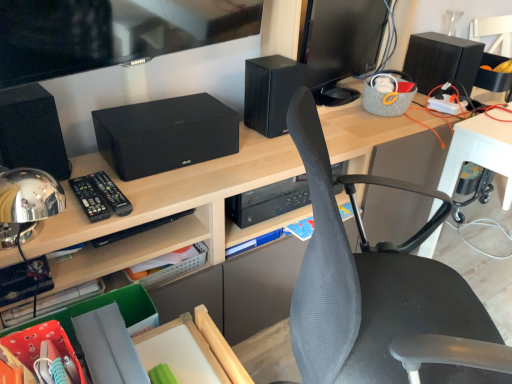
Describe the element at coordinates (32, 131) in the screenshot. I see `black matte speaker at upper left, the third speaker in the right-to-left sequence` at that location.

Image resolution: width=512 pixels, height=384 pixels. I want to click on black matte speaker at center, so click(165, 134).

What do you see at coordinates (111, 193) in the screenshot? I see `black plastic remote at center, positioned as the first control in right-to-left order` at bounding box center [111, 193].

You are a GUI agent. You are given a task and a screenshot of the screen. Output one action in this format:
    pyautogui.click(x=<x>, y=<y>)
    Task: Click on the gray mesh chair at center
    This screenshot has height=384, width=512.
    Given the screenshot: What is the action you would take?
    pyautogui.click(x=381, y=293)

Locate an element on the screen. black plastic remote at left, which appears as the 1th control when viewed from the left is located at coordinates (90, 199).

What is the approximate width of black glossy monitor at upper right?

It is 7.28 inches.

The width and height of the screenshot is (512, 384). What are the coordinates of `black matte speaker at upper left, which appears as the first speaker when viewed from the left` in the screenshot? It's located at (32, 131).

Between point (175, 121) and point (265, 122), which one is positioned in front?

The point (175, 121) is more forward.

How many degrees apart are the facing directions of black matte speaker at center and black matte speaker at center, the 2th speaker in the left-to-right sequence?

4.95 degrees.

Considering their positions, is black matte speaker at center located in front of or behind black matte speaker at center, which ranks as the 2th speaker in front-to-back order?

Visually, black matte speaker at center is located in front of black matte speaker at center, which ranks as the 2th speaker in front-to-back order.

Could you tell me if black matte speaker at center is facing black matte speaker at center, positioned as the 2th speaker in back-to-front order?

No, black matte speaker at center is not aimed at black matte speaker at center, positioned as the 2th speaker in back-to-front order.

Which of these two, black plastic remote at center, which appears as the second control when viewed from the left, or black matte speaker at center, positioned as the 2th speaker in back-to-front order, is bigger?

Bigger between the two is black matte speaker at center, positioned as the 2th speaker in back-to-front order.

Can black matte speaker at center, the 2th speaker in the left-to-right sequence, be found inside black plastic remote at center, which appears as the second control when viewed from the left?

That's incorrect, black matte speaker at center, the 2th speaker in the left-to-right sequence, is not inside black plastic remote at center, which appears as the second control when viewed from the left.

Does black plastic remote at center, positioned as the first control in right-to-left order, have a greater width compared to black matte speaker at center, the second speaker from the right?

Yes.

Considering their positions, is black plastic remote at center, positioned as the first control in right-to-left order, located in front of or behind black matte speaker at center, the 2th speaker in the left-to-right sequence?

black plastic remote at center, positioned as the first control in right-to-left order, is in front of black matte speaker at center, the 2th speaker in the left-to-right sequence.

Is black glossy monitor at upper right next to black plastic remote at left, the second control positioned from the right?

black glossy monitor at upper right and black plastic remote at left, the second control positioned from the right, are not in contact.

Can you confirm if black glossy monitor at upper right is wider than black plastic remote at left, which appears as the 1th control when viewed from the left?

Incorrect, the width of black glossy monitor at upper right does not surpass that of black plastic remote at left, which appears as the 1th control when viewed from the left.

Is black glossy monitor at upper right at the left side of black plastic remote at left, the second control positioned from the right?

In fact, black glossy monitor at upper right is to the right of black plastic remote at left, the second control positioned from the right.

Is black glossy monitor at upper right inside or outside of black plastic remote at left, which appears as the 1th control when viewed from the left?

The correct answer is: outside.

Considering the relative sizes of black plastic remote at left, which appears as the 1th control when viewed from the left, and black matte speaker at upper left, which appears as the first speaker when viewed from the left, in the image provided, is black plastic remote at left, which appears as the 1th control when viewed from the left, thinner than black matte speaker at upper left, which appears as the first speaker when viewed from the left,?

No.

Looking at this image, is black plastic remote at left, which appears as the 1th control when viewed from the left, placed right next to black matte speaker at upper left, positioned as the third speaker in back-to-front order?

No, black plastic remote at left, which appears as the 1th control when viewed from the left, is not beside black matte speaker at upper left, positioned as the third speaker in back-to-front order.

Which is more to the left, black plastic remote at left, which appears as the 1th control when viewed from the left, or black matte speaker at upper left, the third speaker in the right-to-left sequence?

black matte speaker at upper left, the third speaker in the right-to-left sequence.

From a real-world perspective, is gray mesh chair at center above or below black matte speaker at center?

In terms of real-world spatial position, gray mesh chair at center is below black matte speaker at center.

Looking at this image, looking at their sizes, would you say gray mesh chair at center is wider or thinner than black matte speaker at center?

In the image, gray mesh chair at center appears to be wider than black matte speaker at center.

Relative to black matte speaker at center, is gray mesh chair at center in front or behind?

Clearly, gray mesh chair at center is in front of black matte speaker at center.

Is gray mesh chair at center positioned beyond the bounds of black matte speaker at center?

Yes, gray mesh chair at center is outside of black matte speaker at center.

Considering the relative positions of black plastic remote at center, positioned as the first control in right-to-left order, and black matte speaker at upper left, the third speaker in the right-to-left sequence, in the image provided, is black plastic remote at center, positioned as the first control in right-to-left order, to the left or to the right of black matte speaker at upper left, the third speaker in the right-to-left sequence,?

In the image, black plastic remote at center, positioned as the first control in right-to-left order, appears on the right side of black matte speaker at upper left, the third speaker in the right-to-left sequence.

From the image's perspective, is black plastic remote at center, which appears as the second control when viewed from the left, located beneath black matte speaker at upper left, acting as the 1th speaker starting from the front?

Correct, black plastic remote at center, which appears as the second control when viewed from the left, appears lower than black matte speaker at upper left, acting as the 1th speaker starting from the front, in the image.

Does black plastic remote at center, positioned as the first control in right-to-left order, turn towards black matte speaker at upper left, positioned as the third speaker in back-to-front order?

No, black plastic remote at center, positioned as the first control in right-to-left order, is not turned towards black matte speaker at upper left, positioned as the third speaker in back-to-front order.

Considering the relative sizes of gray mesh chair at center and black matte speaker at center, the 2th speaker in the left-to-right sequence, in the image provided, is gray mesh chair at center thinner than black matte speaker at center, the 2th speaker in the left-to-right sequence,?

Incorrect, the width of gray mesh chair at center is not less than that of black matte speaker at center, the 2th speaker in the left-to-right sequence.

Between point (398, 286) and point (290, 82), which one is positioned in front?

The point (398, 286) is more forward.

Can you confirm if gray mesh chair at center is positioned to the left of black matte speaker at center, the 2th speaker in the left-to-right sequence?

In fact, gray mesh chair at center is to the right of black matte speaker at center, the 2th speaker in the left-to-right sequence.

Find the location of a particular element. The width and height of the screenshot is (512, 384). printer in front of the black matte speaker at center, positioned as the 2th speaker in back-to-front order is located at coordinates (165, 134).

From the black matte speaker at center, which ranks as the 2th speaker in front-to-back order, count the 1st control to the left and point to it. Please provide its 2D coordinates.

[(111, 193)]

Based on the photo, considering their positions, is black plastic remote at center, which appears as the second control when viewed from the left, positioned further to black plastic remote at left, the second control positioned from the right, than black matte speaker at center?

black matte speaker at center.

Estimate the real-world distances between objects in this image. Which object is further from black glossy monitor at upper right, gray mesh chair at center or black matte speaker at center, which ranks as the 2th speaker in front-to-back order?

gray mesh chair at center is positioned further to the anchor black glossy monitor at upper right.

From the image, which object appears to be nearer to gray mesh chair at center, black glossy monitor at upper right or black matte speaker at center?

The object closer to gray mesh chair at center is black matte speaker at center.

Looking at the image, which one is located further to black plastic remote at left, the second control positioned from the right, gray mesh chair at center or black glossy monitor at upper right?

black glossy monitor at upper right lies further to black plastic remote at left, the second control positioned from the right, than the other object.

Based on their spatial positions, is black matte speaker at center, positioned as the 2th speaker in back-to-front order, or black glossy monitor at upper right further from black plastic remote at center, which appears as the second control when viewed from the left?

black glossy monitor at upper right lies further to black plastic remote at center, which appears as the second control when viewed from the left, than the other object.

From the image, which object appears to be nearer to black plastic remote at center, which appears as the second control when viewed from the left, black plastic remote at left, the second control positioned from the right, or gray mesh chair at center?

Among the two, black plastic remote at left, the second control positioned from the right, is located nearer to black plastic remote at center, which appears as the second control when viewed from the left.

Estimate the real-world distances between objects in this image. Which object is further from black plastic remote at left, the second control positioned from the right, black matte speaker at upper left, positioned as the third speaker in back-to-front order, or gray mesh chair at center?

gray mesh chair at center lies further to black plastic remote at left, the second control positioned from the right, than the other object.

Looking at the image, which one is located closer to black plastic remote at left, which appears as the 1th control when viewed from the left, black matte speaker at center, the second speaker from the right, or black matte speaker at upper left, positioned as the third speaker in back-to-front order?

The object closer to black plastic remote at left, which appears as the 1th control when viewed from the left, is black matte speaker at upper left, positioned as the third speaker in back-to-front order.

Image resolution: width=512 pixels, height=384 pixels. I want to click on computer monitor located between black matte speaker at center and black matte speaker at upper right, placed as the third speaker when sorted from front to back, in the left-right direction, so click(x=341, y=45).

Locate an element on the screen. This screenshot has height=384, width=512. speaker situated between black plastic remote at left, the second control positioned from the right, and black matte speaker at upper right, which appears as the 1th speaker when viewed from the right, from left to right is located at coordinates (270, 92).

At what (x,y) coordinates should I click in order to perform the action: click on speaker located between black matte speaker at center and black matte speaker at upper right, which appears as the 1th speaker when viewed from the right, in the left-right direction. Please return your answer as a coordinate pair (x, y). The height and width of the screenshot is (384, 512). Looking at the image, I should click on (270, 92).

Find the location of a particular element. printer between black matte speaker at upper left, the third speaker in the right-to-left sequence, and black matte speaker at center, positioned as the 2th speaker in back-to-front order, from left to right is located at coordinates (165, 134).